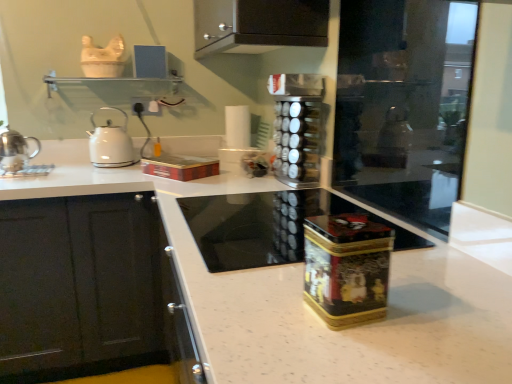
Question: Would you say transparent glass screen door at right is to the left or to the right of white speckled granite at center in the picture?

Choices:
 (A) left
 (B) right

Answer: (B)

Question: Is transparent glass screen door at right taller or shorter than white speckled granite at center?

Choices:
 (A) tall
 (B) short

Answer: (B)

Question: Which of these objects is positioned farthest from the white glossy kettle at left, the first kitchen appliance in the right-to-left sequence?

Choices:
 (A) white speckled granite at center
 (B) shiny silver teapot at left, which is counted as the 1th kitchen appliance, starting from the front
 (C) black glass cooktop at center
 (D) metallic red box at center
 (E) black metallic spice rack at center, positioned as the second appliance in bottom-to-top order

Answer: (A)

Question: Estimate the real-world distances between objects in this image. Which object is closer to the transparent glass screen door at right?

Choices:
 (A) black glass cooktop at center
 (B) shiny silver teapot at left, acting as the second kitchen appliance starting from the back
 (C) white speckled granite at center
 (D) metallic red box at center
 (E) black metallic spice rack at center, placed as the first appliance when sorted from top to bottom

Answer: (E)